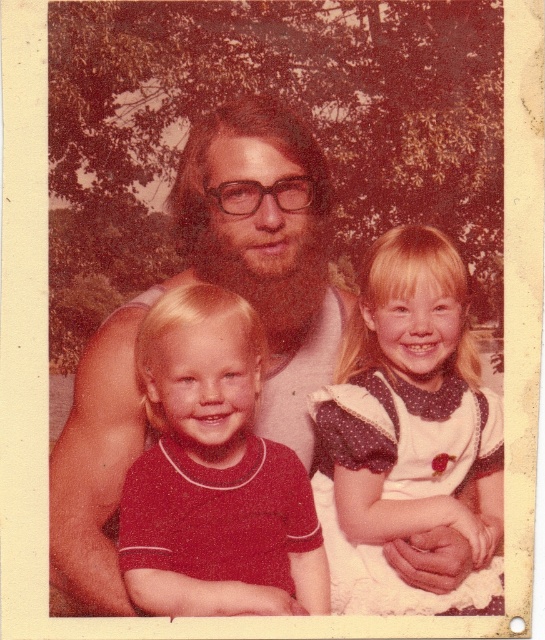
Question: Is matte white shirt at center smaller than matte red shirt at center?

Choices:
 (A) yes
 (B) no

Answer: (B)

Question: Which of these objects is positioned closest to the matte red shirt at center?

Choices:
 (A) white dotted dress at center
 (B) matte white shirt at center

Answer: (B)

Question: Is matte white shirt at center behind white dotted dress at center?

Choices:
 (A) yes
 (B) no

Answer: (B)

Question: Is white dotted dress at center positioned behind matte red shirt at center?

Choices:
 (A) no
 (B) yes

Answer: (B)

Question: Which of the following is the farthest from the observer?

Choices:
 (A) matte red shirt at center
 (B) white dotted dress at center

Answer: (B)

Question: Among these points, which one is nearest to the camera?

Choices:
 (A) click(x=75, y=417)
 (B) click(x=480, y=570)

Answer: (A)